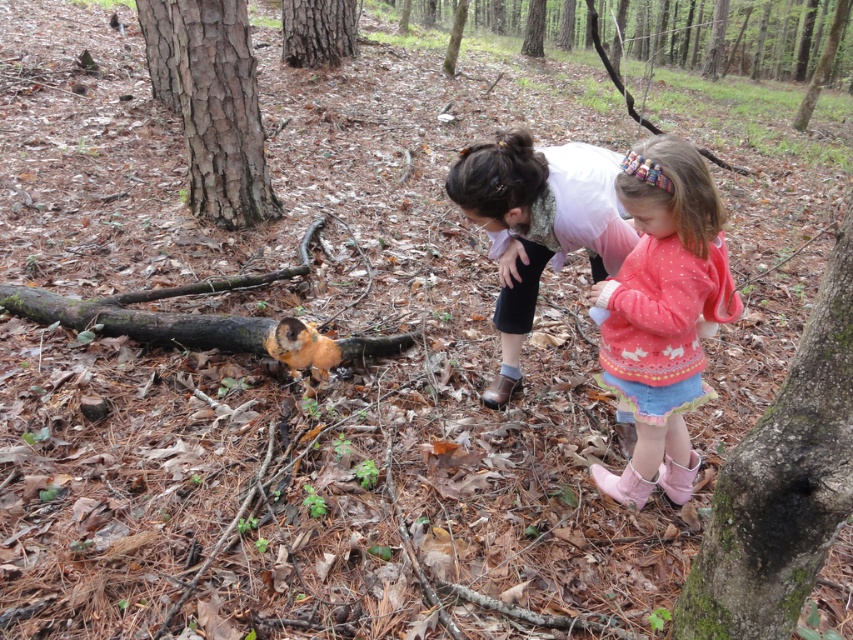
Question: Is brown rough bark tree at left smaller than smooth brown bark at center?

Choices:
 (A) no
 (B) yes

Answer: (B)

Question: Is rough bark tree at upper center wider than smooth brown bark at center?

Choices:
 (A) yes
 (B) no

Answer: (A)

Question: Which point is farther to the camera?

Choices:
 (A) (682, 481)
 (B) (646, 124)

Answer: (B)

Question: Considering the real-world distances, which object is closest to the pink knitted sweater at center?

Choices:
 (A) smooth brown bark at center
 (B) brown rough log at lower left

Answer: (B)

Question: Estimate the real-world distances between objects in this image. Which object is closer to the brown rough log at lower left?

Choices:
 (A) pink fabric at center
 (B) smooth brown bark at center

Answer: (A)

Question: Can you confirm if rough bark tree at upper center is bigger than smooth brown bark at center?

Choices:
 (A) yes
 (B) no

Answer: (A)